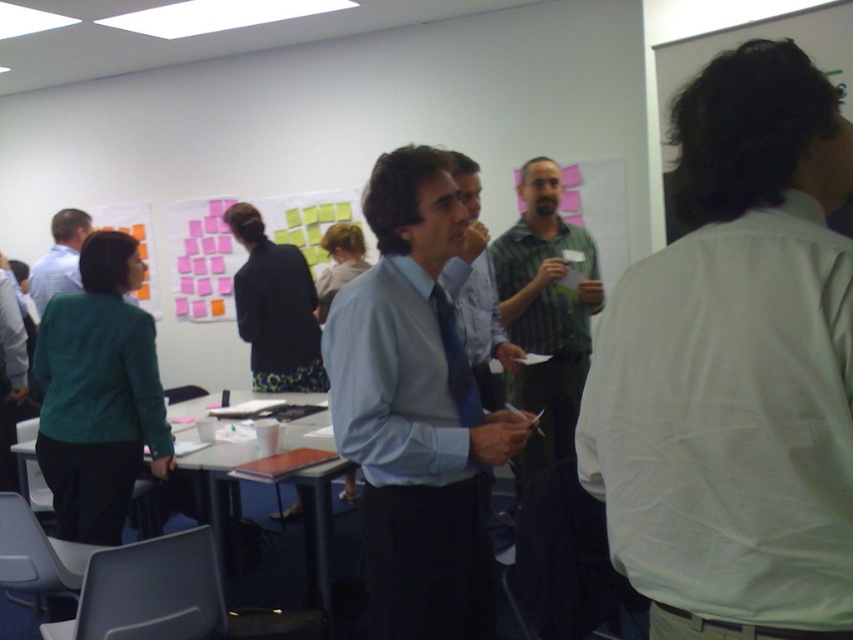
Does white cotton shirt at upper right have a larger size compared to green striped shirt at center?

Incorrect, white cotton shirt at upper right is not larger than green striped shirt at center.

Image resolution: width=853 pixels, height=640 pixels. What are the coordinates of `white cotton shirt at upper right` in the screenshot? It's located at (735, 369).

Can you confirm if light blue shirt at center is positioned to the right of pink paper notes at center?

Correct, you'll find light blue shirt at center to the right of pink paper notes at center.

Is light blue shirt at center positioned in front of pink paper notes at center?

That is True.

Does point (401, 380) come behind point (219, 266)?

No, (401, 380) is closer to viewer.

Locate an element on the screen. The width and height of the screenshot is (853, 640). light blue shirt at center is located at coordinates (416, 412).

Does matte green shirt at left come in front of blue satin tie at center?

No, it is not.

Which is behind, point (61, 292) or point (469, 401)?

The point (61, 292) is more distant.

This screenshot has height=640, width=853. What are the coordinates of `matte green shirt at left` in the screenshot? It's located at (61, 257).